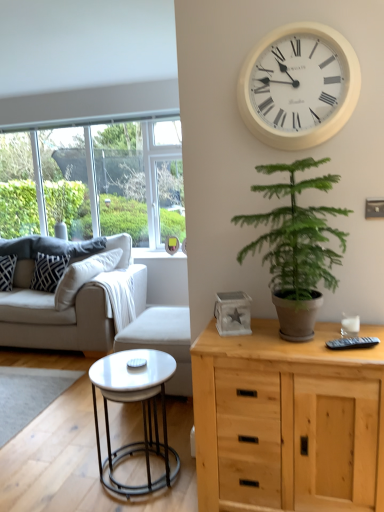
At what (x,y) coordinates should I click in order to perform the action: click on vacant space in front of white fabric armchair at center. Please return your answer as a coordinate pair (x, y). This screenshot has width=384, height=512. Looking at the image, I should click on (133, 428).